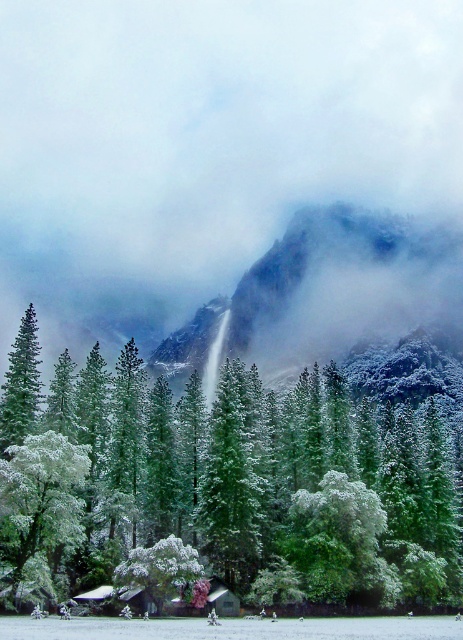
Question: Is snowy rocky mountain at center below green matte evergreen tree at left?

Choices:
 (A) no
 (B) yes

Answer: (A)

Question: Among these objects, which one is nearest to the camera?

Choices:
 (A) snowy rocky mountain at center
 (B) white snow-covered tree at left

Answer: (B)

Question: Is green matte tree at center bigger than white snow-covered tree at left?

Choices:
 (A) yes
 (B) no

Answer: (A)

Question: Is white snow-covered tree at left bigger than green matte evergreen tree at left?

Choices:
 (A) yes
 (B) no

Answer: (B)

Question: Which object is positioned closest to the white fluffy cloud at upper center?

Choices:
 (A) green matte evergreen tree at left
 (B) green matte tree at center

Answer: (B)

Question: Which object appears farthest from the camera in this image?

Choices:
 (A) green matte evergreen tree at left
 (B) snowy rocky mountain at center
 (C) white fluffy cloud at upper center

Answer: (B)